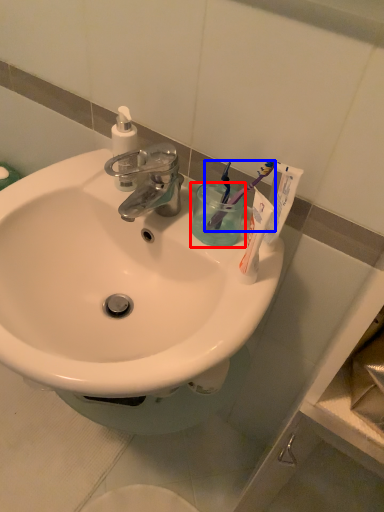
Question: Which object is closer to the camera taking this photo, liquid (highlighted by a red box) or toothbrush (highlighted by a blue box)?

Choices:
 (A) liquid
 (B) toothbrush

Answer: (B)